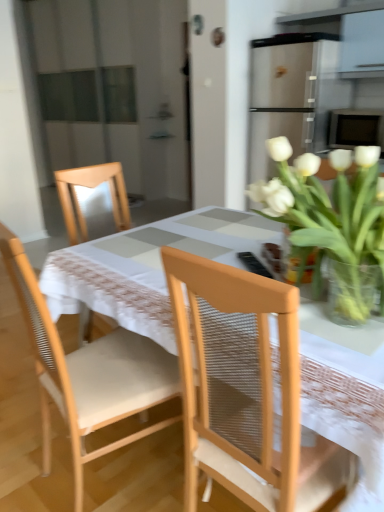
Where is `light brown woven chair at center, the first chair from the right`? This screenshot has height=512, width=384. light brown woven chair at center, the first chair from the right is located at coordinates (246, 391).

I want to click on white glass vase at upper right, so point(327,208).

Locate an element on the screen. This screenshot has width=384, height=512. light brown woven chair at center, the 2th chair from the left is located at coordinates (246, 391).

From a real-world perspective, is white glass vase at upper right positioned above or below wooden chair at center, placed as the first chair when sorted from left to right?

In terms of real-world spatial position, white glass vase at upper right is above wooden chair at center, placed as the first chair when sorted from left to right.

Does white glass vase at upper right have a larger size compared to wooden chair at center, acting as the 2th chair starting from the right?

Actually, white glass vase at upper right might be smaller than wooden chair at center, acting as the 2th chair starting from the right.

Which of these two, white glass vase at upper right or wooden chair at center, acting as the 2th chair starting from the right, stands taller?

Standing taller between the two is wooden chair at center, acting as the 2th chair starting from the right.

Is white glass vase at upper right facing towards clear glass vase at upper right?

Yes, white glass vase at upper right is oriented towards clear glass vase at upper right.

Is white glass vase at upper right taller than clear glass vase at upper right?

Correct, white glass vase at upper right is much taller as clear glass vase at upper right.

Based on the photo, in the image, is white glass vase at upper right positioned in front of or behind clear glass vase at upper right?

Clearly, white glass vase at upper right is in front of clear glass vase at upper right.

Considering the relative positions of white glass vase at upper right and clear glass vase at upper right in the image provided, is white glass vase at upper right to the right of clear glass vase at upper right from the viewer's perspective?

Correct, you'll find white glass vase at upper right to the right of clear glass vase at upper right.

Considering the relative positions of clear glass vase at upper right and wooden chair at center, acting as the 2th chair starting from the right, in the image provided, is clear glass vase at upper right to the left or to the right of wooden chair at center, acting as the 2th chair starting from the right,?

Clearly, clear glass vase at upper right is on the right of wooden chair at center, acting as the 2th chair starting from the right, in the image.

Looking at their sizes, would you say clear glass vase at upper right is wider or thinner than wooden chair at center, placed as the first chair when sorted from left to right?

In the image, clear glass vase at upper right appears to be more narrow than wooden chair at center, placed as the first chair when sorted from left to right.

Does clear glass vase at upper right have a greater height compared to wooden chair at center, acting as the 2th chair starting from the right?

Incorrect, the height of clear glass vase at upper right is not larger of that of wooden chair at center, acting as the 2th chair starting from the right.

Is clear glass vase at upper right oriented towards wooden chair at center, placed as the first chair when sorted from left to right?

No, clear glass vase at upper right is not turned towards wooden chair at center, placed as the first chair when sorted from left to right.

Do you think light brown woven chair at center, the first chair from the right, is within clear glass vase at upper right, or outside of it?

light brown woven chair at center, the first chair from the right, is spatially situated outside clear glass vase at upper right.

Considering the points (262, 365) and (304, 278), which point is in front, point (262, 365) or point (304, 278)?

Point (262, 365)

Relative to clear glass vase at upper right, is light brown woven chair at center, the 2th chair from the left, in front or behind?

In the image, light brown woven chair at center, the 2th chair from the left, appears in front of clear glass vase at upper right.

Would you say light brown woven chair at center, the 2th chair from the left, is to the left or to the right of clear glass vase at upper right in the picture?

Clearly, light brown woven chair at center, the 2th chair from the left, is on the left of clear glass vase at upper right in the image.

Is white glass vase at upper right surrounded by white fabric table at center?

Actually, white glass vase at upper right is outside white fabric table at center.

Looking at this image, can you confirm if white fabric table at center is positioned to the right of white glass vase at upper right?

In fact, white fabric table at center is to the left of white glass vase at upper right.

Between white fabric table at center and white glass vase at upper right, which one has larger width?

Wider between the two is white fabric table at center.

From the image's perspective, which is above, white fabric table at center or white glass vase at upper right?

white glass vase at upper right.

Between clear glass vase at upper right and light brown woven chair at center, the 2th chair from the left, which one has smaller width?

clear glass vase at upper right is thinner.

Are clear glass vase at upper right and light brown woven chair at center, the 2th chair from the left, located far from each other?

clear glass vase at upper right is near light brown woven chair at center, the 2th chair from the left, not far away.

From the image's perspective, count 2nd chairs downward from the clear glass vase at upper right and point to it. Please provide its 2D coordinates.

[(246, 391)]

Is clear glass vase at upper right positioned with its back to light brown woven chair at center, the 2th chair from the left?

Yes.

Could you measure the distance between light brown woven chair at center, the 2th chair from the left, and white glass vase at upper right?

light brown woven chair at center, the 2th chair from the left, is 13.80 inches from white glass vase at upper right.

Is light brown woven chair at center, the first chair from the right, aimed at white glass vase at upper right?

No, light brown woven chair at center, the first chair from the right, does not turn towards white glass vase at upper right.

Are light brown woven chair at center, the first chair from the right, and white glass vase at upper right located far from each other?

No, there isn't a large distance between light brown woven chair at center, the first chair from the right, and white glass vase at upper right.

Considering their positions, is light brown woven chair at center, the first chair from the right, located in front of or behind white glass vase at upper right?

light brown woven chair at center, the first chair from the right, is positioned closer to the viewer than white glass vase at upper right.

Identify the location of houseplant above the wooden chair at center, placed as the first chair when sorted from left to right (from a real-world perspective). (327, 208).

In the image, there is a clear glass vase at upper right. Identify the location of houseplant above it (from the image's perspective). The image size is (384, 512). (327, 208).

Looking at the image, which one is located closer to white glass vase at upper right, clear glass vase at upper right or white fabric table at center?

Among the two, clear glass vase at upper right is located nearer to white glass vase at upper right.

From the image, which object appears to be farther from wooden chair at center, placed as the first chair when sorted from left to right, white glass vase at upper right or light brown woven chair at center, the first chair from the right?

Among the two, white glass vase at upper right is located further to wooden chair at center, placed as the first chair when sorted from left to right.

In the scene shown: Estimate the real-world distances between objects in this image. Which object is further from light brown woven chair at center, the first chair from the right, white fabric table at center or wooden chair at center, placed as the first chair when sorted from left to right?

white fabric table at center is positioned further to the anchor light brown woven chair at center, the first chair from the right.

In the scene shown: Based on their spatial positions, is white glass vase at upper right or white fabric table at center further from wooden chair at center, placed as the first chair when sorted from left to right?

white glass vase at upper right lies further to wooden chair at center, placed as the first chair when sorted from left to right, than the other object.

Based on the photo, looking at the image, which one is located closer to white fabric table at center, light brown woven chair at center, the 2th chair from the left, or white glass vase at upper right?

light brown woven chair at center, the 2th chair from the left.

Looking at the image, which one is located closer to white fabric table at center, clear glass vase at upper right or wooden chair at center, placed as the first chair when sorted from left to right?

Based on the image, wooden chair at center, placed as the first chair when sorted from left to right, appears to be nearer to white fabric table at center.

When comparing their distances from white fabric table at center, does clear glass vase at upper right or white glass vase at upper right seem further?

Among the two, white glass vase at upper right is located further to white fabric table at center.

Looking at the image, which one is located further to wooden chair at center, placed as the first chair when sorted from left to right, light brown woven chair at center, the first chair from the right, or white glass vase at upper right?

white glass vase at upper right is positioned further to the anchor wooden chair at center, placed as the first chair when sorted from left to right.

Where is `chair between wooden chair at center, acting as the 2th chair starting from the right, and white glass vase at upper right, in the horizontal direction`? The width and height of the screenshot is (384, 512). chair between wooden chair at center, acting as the 2th chair starting from the right, and white glass vase at upper right, in the horizontal direction is located at coordinates (246, 391).

This screenshot has height=512, width=384. In order to click on houseplant located between light brown woven chair at center, the 2th chair from the left, and clear glass vase at upper right in the depth direction in this screenshot , I will do `click(327, 208)`.

You are a GUI agent. You are given a task and a screenshot of the screen. Output one action in this format:
    pyautogui.click(x=<x>, y=<y>)
    Task: Click on the kitchen & dining room table that lies between white glass vase at upper right and light brown woven chair at center, the 2th chair from the left, from top to bottom
    The image size is (384, 512).
    Given the screenshot: What is the action you would take?
    pyautogui.click(x=147, y=267)

You are a GUI agent. You are given a task and a screenshot of the screen. Output one action in this format:
    pyautogui.click(x=<x>, y=<y>)
    Task: Click on the kitchen & dining room table located between wooden chair at center, acting as the 2th chair starting from the right, and clear glass vase at upper right in the left-right direction
    This screenshot has height=512, width=384.
    Given the screenshot: What is the action you would take?
    pyautogui.click(x=147, y=267)